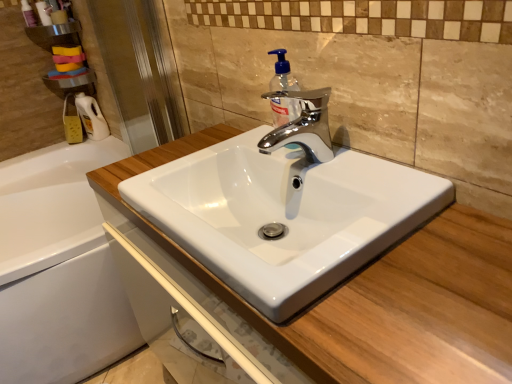
This screenshot has height=384, width=512. In order to click on unoccupied area in front of transparent plastic soap dispenser at center in this screenshot , I will do `click(345, 171)`.